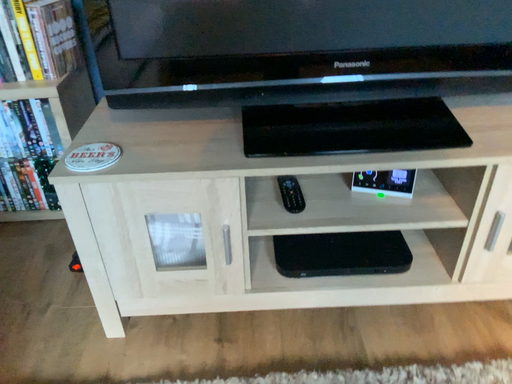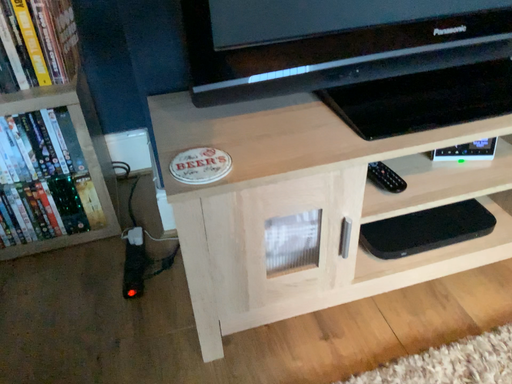
Question: Which way did the camera rotate in the video?

Choices:
 (A) rotated left
 (B) rotated right

Answer: (B)